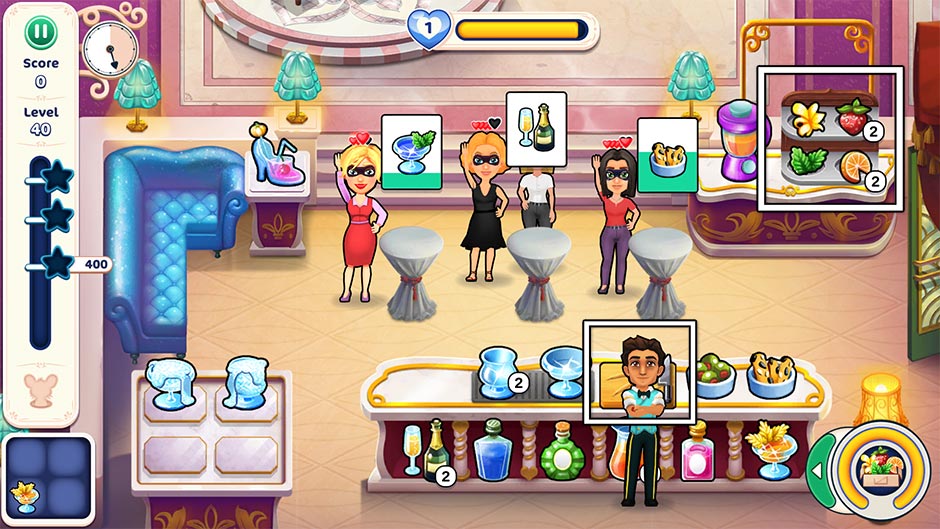
The width and height of the screenshot is (940, 529). I want to click on blender, so click(732, 136).